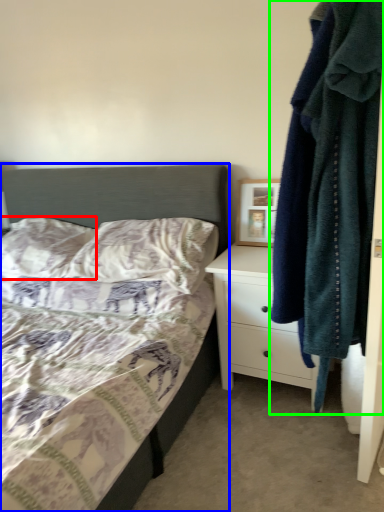
Question: Which object is positioned farthest from pillow (highlighted by a red box)? Select from bed (highlighted by a blue box) and laundry (highlighted by a green box).

Choices:
 (A) bed
 (B) laundry

Answer: (B)